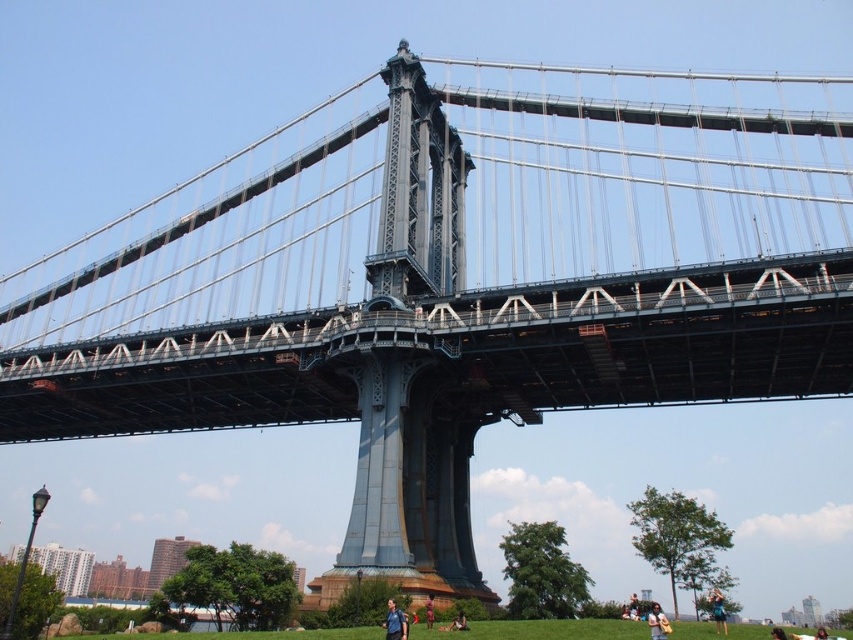
You are a photographer standing at the grassy area in front of the suspension bridge. You notice a blue fabric backpack at lower center and blue denim jeans at lower center. Which object is shorter in height?

The blue fabric backpack at lower center is not as tall as the blue denim jeans at lower center, so the backpack is shorter in height.